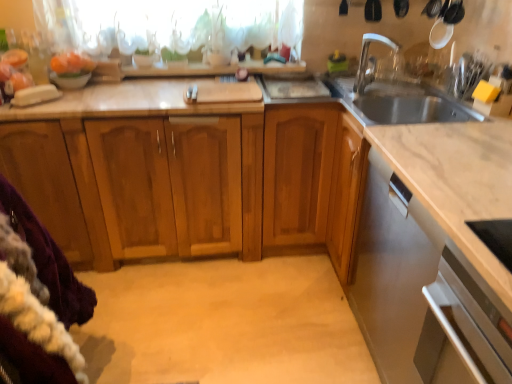
This screenshot has width=512, height=384. Find the location of `vacant space that is to the left of white glossy faucet at upper right`. vacant space that is to the left of white glossy faucet at upper right is located at coordinates (326, 96).